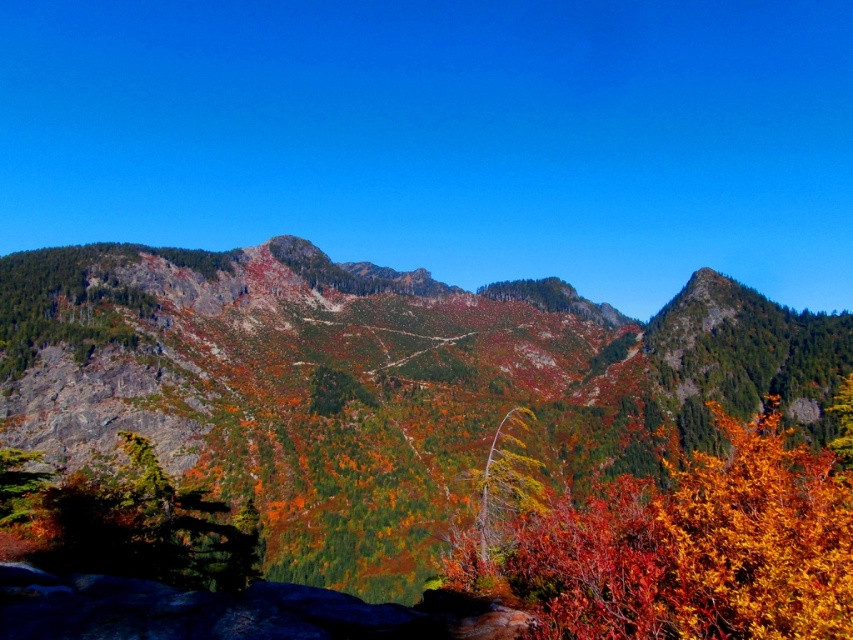
You are a hiker standing at the base of the mountain. You see a point marked at coordinates point (701,545). According to the map, this point is at the center of the image. Where should you look to find the shiny orange leaves?

The point (701,545) marks the shiny orange leaves at center, so you should look at the center of the image to find them.

You are a hiker who just arrived at the mountain trailhead. You notice shiny orange leaves at center and a green textured tree at lower left. Which object is higher up in the landscape?

The shiny orange leaves at center are located above the green textured tree at lower left, so the shiny orange leaves at center are higher up in the landscape.

You are a hiker planning a route through the mountain landscape. You see the rocky cliff face at center and the green textured tree at lower left. Which object is higher up in the scene?

The rocky cliff face at center is positioned over the green textured tree at lower left, so it is higher up in the scene.